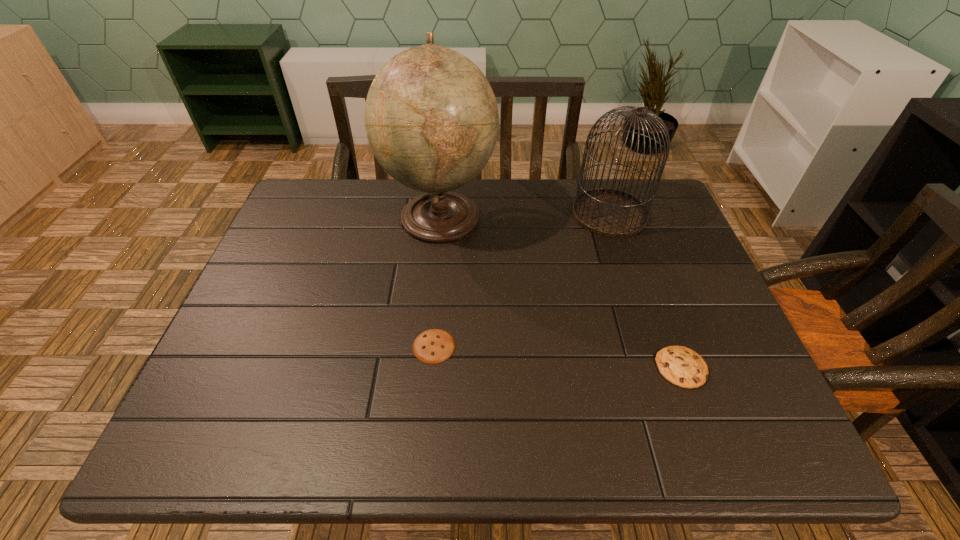
Where is `vacant position at the far right corner of the desktop`? vacant position at the far right corner of the desktop is located at coordinates pyautogui.click(x=662, y=190).

Find the location of a particular element. The width and height of the screenshot is (960, 540). vacant area between the third shortest object and the taller cookie is located at coordinates (645, 291).

Locate an element on the screen. free space between the second tallest object and the left cookie is located at coordinates (521, 280).

Find the location of a particular element. free space between the birdcage and the right cookie is located at coordinates (645, 291).

Where is `free space between the globe and the right cookie`? free space between the globe and the right cookie is located at coordinates (562, 292).

This screenshot has width=960, height=540. Identify the location of empty location between the second shortest object and the shortest object. (558, 357).

You are a GUI agent. You are given a task and a screenshot of the screen. Output one action in this format:
    pyautogui.click(x=<x>, y=<y>)
    Task: Click on the free space between the left cookie and the second shortest object
    The image size is (960, 540).
    Given the screenshot: What is the action you would take?
    pyautogui.click(x=558, y=357)

Image resolution: width=960 pixels, height=540 pixels. In order to click on empty space between the second shortest object and the tallest object in this screenshot , I will do `click(562, 292)`.

Where is `free spot between the second tallest object and the globe`? free spot between the second tallest object and the globe is located at coordinates (525, 215).

You are a GUI agent. You are given a task and a screenshot of the screen. Output one action in this format:
    pyautogui.click(x=<x>, y=<y>)
    Task: Click on the free space between the globe and the right cookie
    
    Given the screenshot: What is the action you would take?
    pyautogui.click(x=562, y=292)